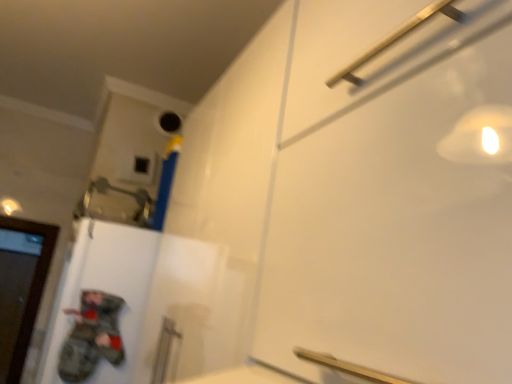
Question: Is camouflage fabric pants at lower left positioned beyond the bounds of wooden door at left?

Choices:
 (A) yes
 (B) no

Answer: (A)

Question: Does camouflage fabric pants at lower left have a smaller size compared to wooden door at left?

Choices:
 (A) no
 (B) yes

Answer: (B)

Question: Can you confirm if camouflage fabric pants at lower left is taller than wooden door at left?

Choices:
 (A) yes
 (B) no

Answer: (B)

Question: Can you confirm if camouflage fabric pants at lower left is bigger than wooden door at left?

Choices:
 (A) yes
 (B) no

Answer: (B)

Question: Considering the relative sizes of camouflage fabric pants at lower left and wooden door at left in the image provided, is camouflage fabric pants at lower left shorter than wooden door at left?

Choices:
 (A) yes
 (B) no

Answer: (A)

Question: Is there a large distance between camouflage fabric pants at lower left and wooden door at left?

Choices:
 (A) no
 (B) yes

Answer: (B)

Question: Are wooden door at left and camouflage fabric pants at lower left beside each other?

Choices:
 (A) no
 (B) yes

Answer: (A)

Question: Can you confirm if wooden door at left is thinner than camouflage fabric pants at lower left?

Choices:
 (A) yes
 (B) no

Answer: (B)

Question: From a real-world perspective, is wooden door at left under camouflage fabric pants at lower left?

Choices:
 (A) yes
 (B) no

Answer: (A)

Question: Is wooden door at left positioned in front of camouflage fabric pants at lower left?

Choices:
 (A) yes
 (B) no

Answer: (B)

Question: From a real-world perspective, is wooden door at left on top of camouflage fabric pants at lower left?

Choices:
 (A) no
 (B) yes

Answer: (A)

Question: Does wooden door at left appear on the right side of camouflage fabric pants at lower left?

Choices:
 (A) no
 (B) yes

Answer: (A)

Question: Does point (18, 288) appear closer or farther from the camera than point (108, 352)?

Choices:
 (A) farther
 (B) closer

Answer: (A)